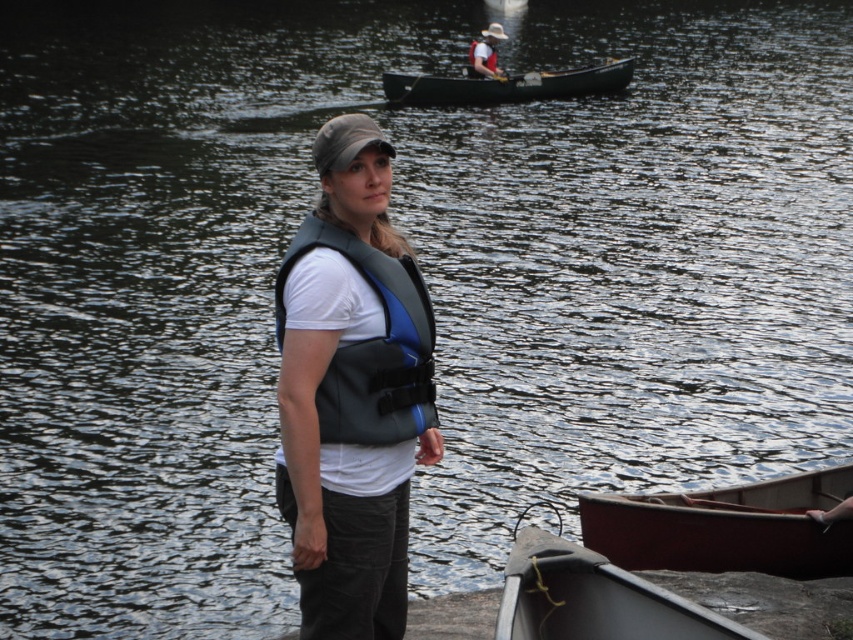
You are standing at the point marked as point (726, 528) in the image. What object is located at this point?

The point (726, 528) corresponds to the smooth red canoe at lower right.

You are the person in the life vest at the lakeside. You want to grab your white fabric baseball hat at upper center but there is a smooth red canoe at lower right blocking your path. Can you reach the hat without moving the canoe?

The smooth red canoe at lower right is in front of the white fabric baseball hat at upper center, so the canoe is blocking the path to the hat. You would need to move the canoe to reach the hat.